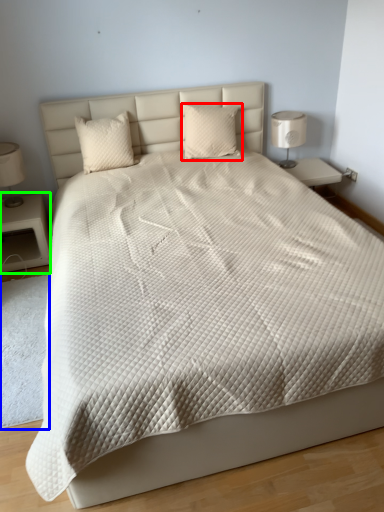
Question: Considering the real-world distances, which object is farthest from pillow (highlighted by a red box)? mat (highlighted by a blue box) or nightstand (highlighted by a green box)?

Choices:
 (A) mat
 (B) nightstand

Answer: (A)